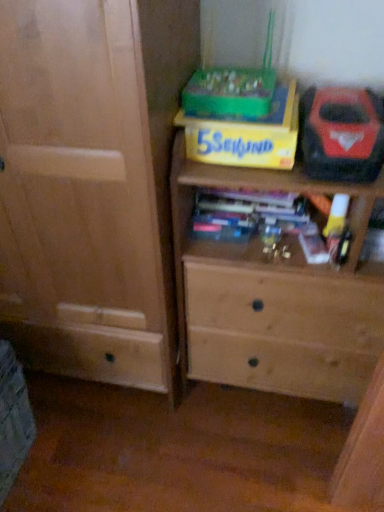
Question: Is light brown wood chest of drawers at center outside red plastic tool at upper right?

Choices:
 (A) yes
 (B) no

Answer: (A)

Question: Is light brown wood chest of drawers at center smaller than red plastic tool at upper right?

Choices:
 (A) yes
 (B) no

Answer: (B)

Question: Can you confirm if light brown wood chest of drawers at center is bigger than red plastic tool at upper right?

Choices:
 (A) no
 (B) yes

Answer: (B)

Question: Does light brown wood chest of drawers at center have a lesser height compared to red plastic tool at upper right?

Choices:
 (A) no
 (B) yes

Answer: (A)

Question: From the image's perspective, is light brown wood chest of drawers at center located beneath red plastic tool at upper right?

Choices:
 (A) no
 (B) yes

Answer: (B)

Question: From a real-world perspective, is light brown wood chest of drawers at center on top of red plastic tool at upper right?

Choices:
 (A) yes
 (B) no

Answer: (B)

Question: Is yellow cardboard box at upper center further to the viewer compared to red plastic tool at upper right?

Choices:
 (A) no
 (B) yes

Answer: (B)

Question: Can you confirm if yellow cardboard box at upper center is positioned to the right of red plastic tool at upper right?

Choices:
 (A) no
 (B) yes

Answer: (A)

Question: Is yellow cardboard box at upper center smaller than red plastic tool at upper right?

Choices:
 (A) yes
 (B) no

Answer: (A)

Question: Does yellow cardboard box at upper center touch red plastic tool at upper right?

Choices:
 (A) yes
 (B) no

Answer: (B)

Question: Can you confirm if yellow cardboard box at upper center is thinner than red plastic tool at upper right?

Choices:
 (A) yes
 (B) no

Answer: (A)

Question: Considering the relative sizes of yellow cardboard box at upper center and red plastic tool at upper right in the image provided, is yellow cardboard box at upper center shorter than red plastic tool at upper right?

Choices:
 (A) yes
 (B) no

Answer: (A)

Question: Is red plastic tool at upper right smaller than light brown wood chest of drawers at center?

Choices:
 (A) yes
 (B) no

Answer: (A)